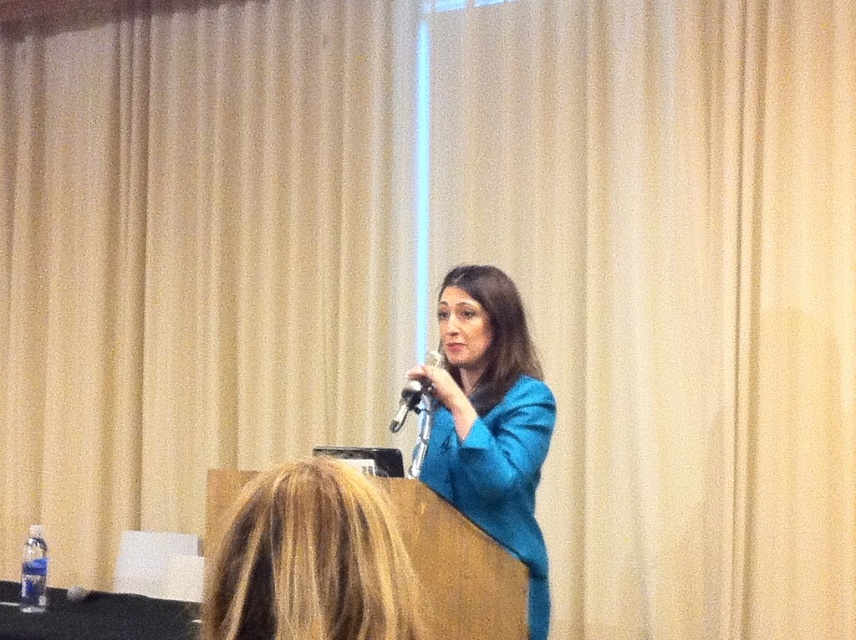
You are a photographer setting up for a presentation. The woman in the bright blue blazer is at the podium, and you notice a point at coordinates (186, 260). What object is located at that point?

The point at coordinates (186, 260) corresponds to the beige textured curtain at upper center.

You are a sound technician adjusting the microphone for a speaker. You need to ensure that the microphone is visible to the audience. Is the metallic silver microphone at center obstructed by the beige textured curtain at upper center?

The beige textured curtain at upper center is positioned over the metallic silver microphone at center, so it is obstructed and not fully visible to the audience.

You are a photographer adjusting your camera settings to capture the speaker at the podium. You notice a specific point marked at coordinates point (308,561). Based on the scene, where is this point located?

The point (308,561) is located on the blonde hair at upper center.